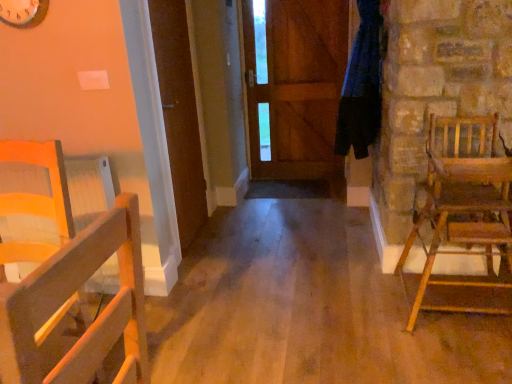
Question: Considering the relative sizes of wooden door at center, marked as the 1th door in a back-to-front arrangement, and wooden rocking chair at right, marked as the 1th chair in a right-to-left arrangement, in the image provided, is wooden door at center, marked as the 1th door in a back-to-front arrangement, taller than wooden rocking chair at right, marked as the 1th chair in a right-to-left arrangement,?

Choices:
 (A) yes
 (B) no

Answer: (A)

Question: Considering the relative sizes of wooden door at center, marked as the 1th door in a back-to-front arrangement, and wooden rocking chair at right, acting as the 2th chair starting from the left, in the image provided, is wooden door at center, marked as the 1th door in a back-to-front arrangement, shorter than wooden rocking chair at right, acting as the 2th chair starting from the left,?

Choices:
 (A) yes
 (B) no

Answer: (B)

Question: Can you confirm if wooden door at center, which appears as the 1th door when viewed from the right, is bigger than wooden rocking chair at right, marked as the 1th chair in a right-to-left arrangement?

Choices:
 (A) no
 (B) yes

Answer: (A)

Question: Considering the relative positions of wooden door at center, arranged as the second door when viewed from the front, and wooden rocking chair at right, marked as the 1th chair in a right-to-left arrangement, in the image provided, is wooden door at center, arranged as the second door when viewed from the front, to the left of wooden rocking chair at right, marked as the 1th chair in a right-to-left arrangement, from the viewer's perspective?

Choices:
 (A) no
 (B) yes

Answer: (B)

Question: From the image's perspective, is wooden door at center, arranged as the second door when viewed from the front, under wooden rocking chair at right, acting as the 2th chair starting from the left?

Choices:
 (A) no
 (B) yes

Answer: (A)

Question: In terms of height, does wooden clock at upper left look taller or shorter compared to wooden door at center, which appears as the 1th door when viewed from the right?

Choices:
 (A) tall
 (B) short

Answer: (B)

Question: From a real-world perspective, relative to wooden door at center, which appears as the 1th door when viewed from the right, is wooden clock at upper left vertically above or below?

Choices:
 (A) above
 (B) below

Answer: (A)

Question: Considering the positions of wooden clock at upper left and wooden door at center, marked as the 1th door in a back-to-front arrangement, in the image, is wooden clock at upper left wider or thinner than wooden door at center, marked as the 1th door in a back-to-front arrangement,?

Choices:
 (A) thin
 (B) wide

Answer: (B)

Question: Do you think wooden clock at upper left is within wooden door at center, which appears as the 1th door when viewed from the right, or outside of it?

Choices:
 (A) inside
 (B) outside

Answer: (B)

Question: From the image's perspective, is wooden rocking chair at right, acting as the 2th chair starting from the left, located above or below blue fabric at right?

Choices:
 (A) above
 (B) below

Answer: (B)

Question: Considering the positions of wooden rocking chair at right, marked as the 1th chair in a right-to-left arrangement, and blue fabric at right in the image, is wooden rocking chair at right, marked as the 1th chair in a right-to-left arrangement, wider or thinner than blue fabric at right?

Choices:
 (A) thin
 (B) wide

Answer: (B)

Question: From a real-world perspective, is wooden rocking chair at right, marked as the 1th chair in a right-to-left arrangement, above or below blue fabric at right?

Choices:
 (A) above
 (B) below

Answer: (B)

Question: In terms of height, does wooden rocking chair at right, acting as the 2th chair starting from the left, look taller or shorter compared to blue fabric at right?

Choices:
 (A) tall
 (B) short

Answer: (B)

Question: Do you think wooden clock at upper left is within wooden door at center, acting as the second door starting from the back, or outside of it?

Choices:
 (A) outside
 (B) inside

Answer: (A)

Question: From the image's perspective, is wooden clock at upper left positioned above or below wooden door at center, acting as the 2th door starting from the right?

Choices:
 (A) below
 (B) above

Answer: (B)